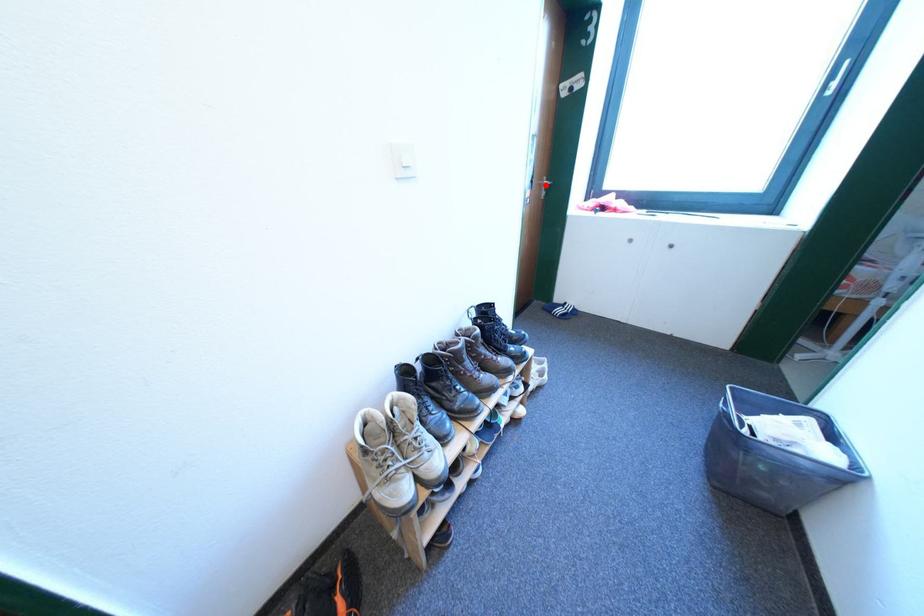
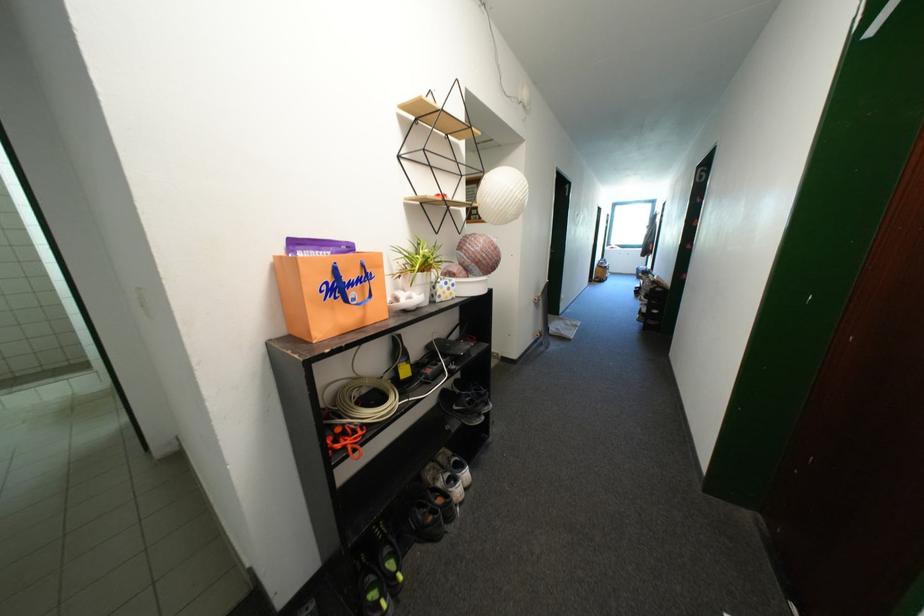
Question: I am providing you with two images of the same scene from different viewpoints. A red point is marked on the first image. Is the red point's position out of view in image 2?

Choices:
 (A) Yes
 (B) No

Answer: (A)